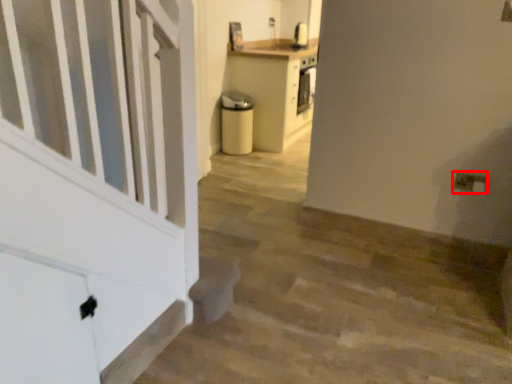
Question: From the image's perspective, what is the correct spatial positioning of electric outlet (annotated by the red box) in reference to stairwell?

Choices:
 (A) below
 (B) above

Answer: (B)